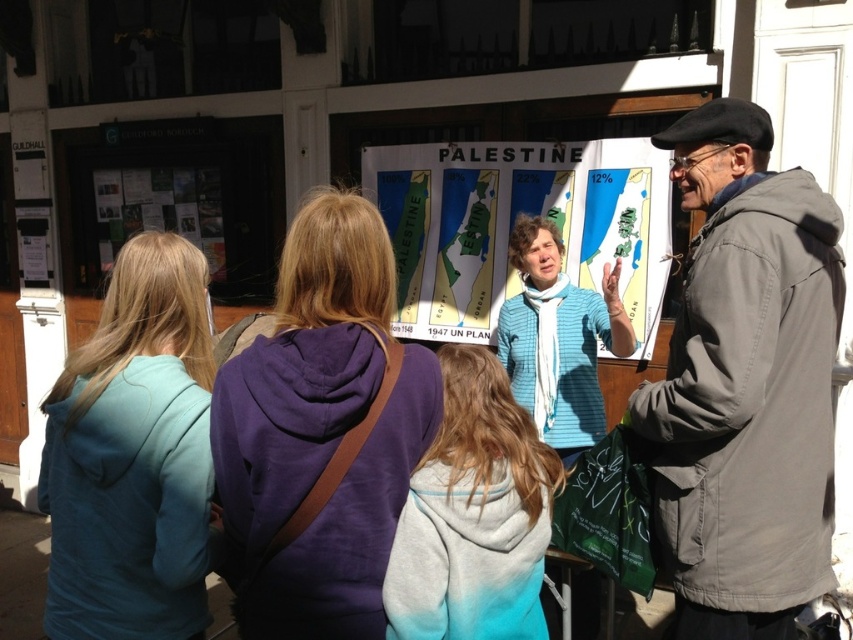
Question: Which point is farther from the camera taking this photo?

Choices:
 (A) (315, 380)
 (B) (570, 369)
 (C) (830, 422)

Answer: (B)

Question: Which object is the closest to the light blue hoodie at center?

Choices:
 (A) knitted blue sweater at center
 (B) purple fleece jacket at center
 (C) teal hoodie at left

Answer: (B)

Question: Which point appears closest to the camera in this image?

Choices:
 (A) (408, 410)
 (B) (123, 545)
 (C) (757, 396)
 (D) (544, 387)

Answer: (A)

Question: Is gray cotton jacket at right to the right of knitted blue sweater at center from the viewer's perspective?

Choices:
 (A) yes
 (B) no

Answer: (A)

Question: Does purple fleece jacket at center have a lesser width compared to light blue hoodie at center?

Choices:
 (A) no
 (B) yes

Answer: (A)

Question: Can you confirm if teal hoodie at left is thinner than light blue hoodie at center?

Choices:
 (A) no
 (B) yes

Answer: (A)